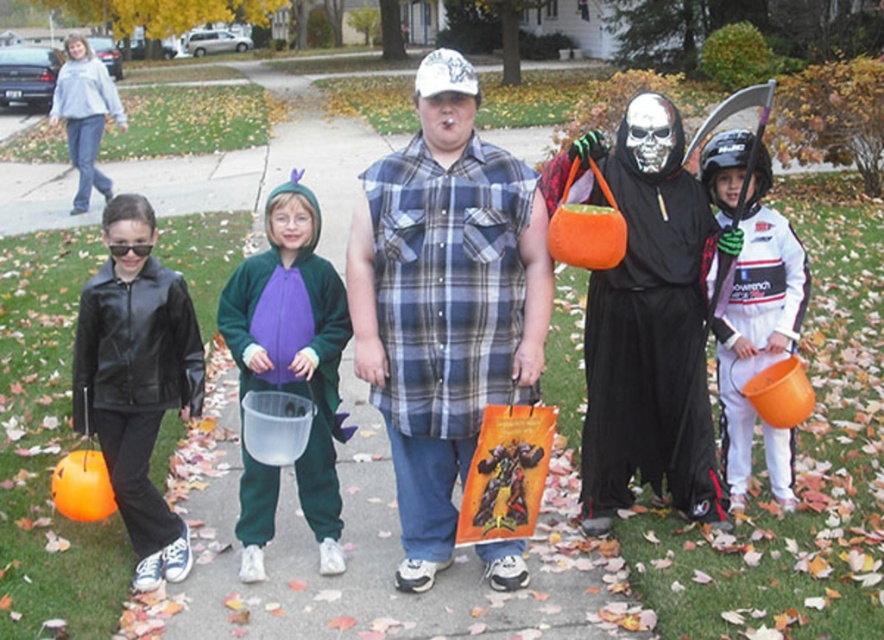
Is shiny black leather jacket at left to the left of green fuzzy onesie at center from the viewer's perspective?

Indeed, shiny black leather jacket at left is positioned on the left side of green fuzzy onesie at center.

Does shiny black leather jacket at left have a greater width compared to green fuzzy onesie at center?

No, shiny black leather jacket at left is not wider than green fuzzy onesie at center.

Locate an element on the screen. shiny black leather jacket at left is located at coordinates (136, 380).

Find the location of a particular element. This screenshot has width=884, height=640. shiny black leather jacket at left is located at coordinates (136, 380).

Does black matte robe at center have a smaller size compared to green fuzzy onesie at center?

No, black matte robe at center is not smaller than green fuzzy onesie at center.

Who is higher up, black matte robe at center or green fuzzy onesie at center?

black matte robe at center is above.

This screenshot has height=640, width=884. What do you see at coordinates (645, 321) in the screenshot?
I see `black matte robe at center` at bounding box center [645, 321].

In order to click on black matte robe at center in this screenshot , I will do `click(645, 321)`.

Can you confirm if green fuzzy onesie at center is positioned above white matte helmet at upper right?

Actually, green fuzzy onesie at center is below white matte helmet at upper right.

Does point (306, 339) come in front of point (755, 312)?

That is True.

Is point (286, 292) positioned before point (742, 349)?

Yes, it is.

At what (x,y) coordinates should I click in order to perform the action: click on green fuzzy onesie at center. Please return your answer as a coordinate pair (x, y). This screenshot has width=884, height=640. Looking at the image, I should click on (295, 346).